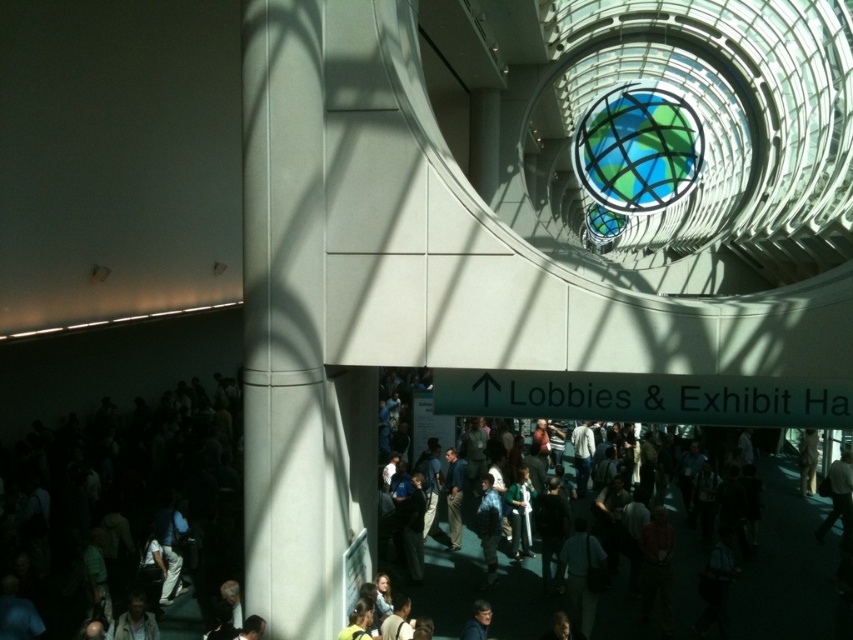
Question: Which is nearer to the dark gray textured jacket at center?

Choices:
 (A) dark gray suit at lower left
 (B) white smooth pillar at left

Answer: (A)

Question: Does dark gray suit at lower left lie behind white smooth pillar at left?

Choices:
 (A) no
 (B) yes

Answer: (B)

Question: Which is nearer to the dark gray textured jacket at center?

Choices:
 (A) white smooth pillar at left
 (B) dark gray suit at lower left

Answer: (B)

Question: Can you confirm if white smooth pillar at left is positioned to the right of dark gray textured jacket at center?

Choices:
 (A) yes
 (B) no

Answer: (B)

Question: Is dark gray suit at lower left to the left of dark gray textured jacket at center from the viewer's perspective?

Choices:
 (A) yes
 (B) no

Answer: (A)

Question: Considering the real-world distances, which object is closest to the dark gray suit at lower left?

Choices:
 (A) dark gray textured jacket at center
 (B) white smooth pillar at left

Answer: (A)